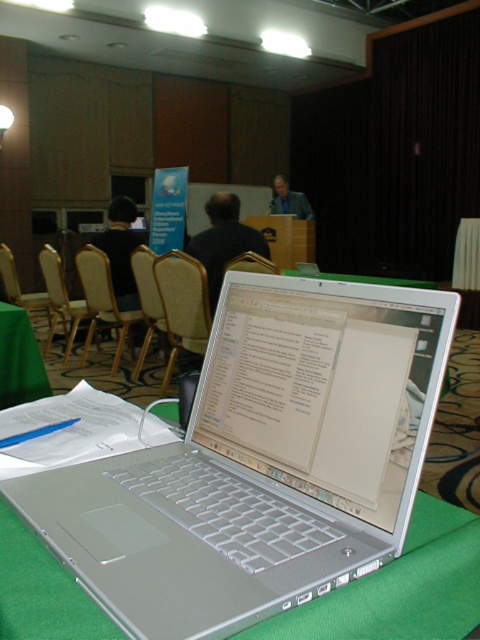
Which is more to the left, green fabric tablecloth at lower left or light brown wood chair at center?

green fabric tablecloth at lower left

Is green fabric tablecloth at lower left to the left of light brown wood chair at center from the viewer's perspective?

Correct, you'll find green fabric tablecloth at lower left to the left of light brown wood chair at center.

Between point (9, 346) and point (149, 260), which one is positioned behind?

Point (149, 260)

This screenshot has width=480, height=640. What are the coordinates of `green fabric tablecloth at lower left` in the screenshot? It's located at (20, 358).

Is beige fabric chair at center positioned at the back of light beige leather chair at center?

No, beige fabric chair at center is closer to the viewer.

Is beige fabric chair at center below light beige leather chair at center?

Yes.

Find the location of a particular element. The width and height of the screenshot is (480, 640). beige fabric chair at center is located at coordinates (182, 305).

Between point (54, 259) and point (153, 312), which one is positioned behind?

Positioned behind is point (54, 259).

Does point (45, 250) come closer to viewer compared to point (137, 257)?

No, it is behind (137, 257).

Find the location of a particular element. light beige fabric chair at left is located at coordinates (60, 300).